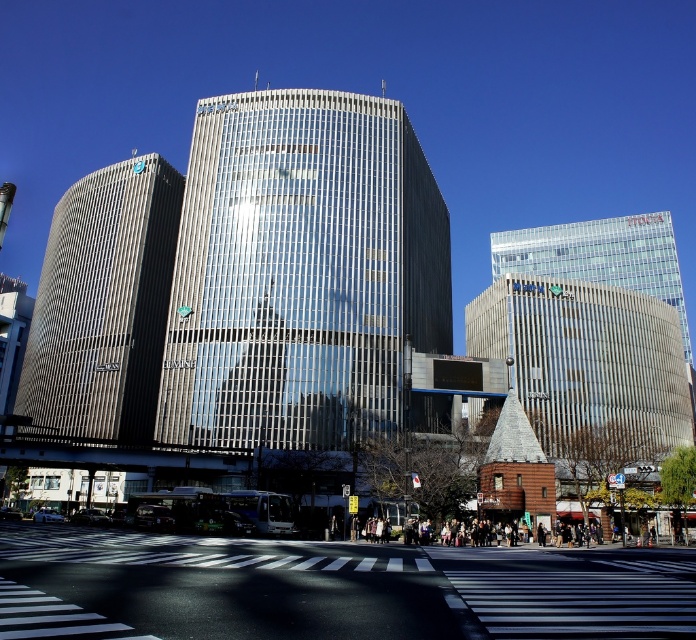
Question: Is glassy reflective building at center above metallic silver building at left?

Choices:
 (A) no
 (B) yes

Answer: (B)

Question: Can you confirm if metallic silver building at left is smaller than brown wooden tower at center?

Choices:
 (A) yes
 (B) no

Answer: (B)

Question: Among these objects, which one is farthest from the camera?

Choices:
 (A) glassy reflective building at center
 (B) metallic silver building at left
 (C) transparent glass building at upper right

Answer: (C)

Question: Which point is farther from the camera taking this photo?

Choices:
 (A) (316, 112)
 (B) (599, 452)

Answer: (B)

Question: Which object is closer to the camera taking this photo?

Choices:
 (A) metallic silver building at left
 (B) brown wooden tower at center

Answer: (A)

Question: Does metallic silver building at left have a smaller size compared to transparent glass building at upper right?

Choices:
 (A) no
 (B) yes

Answer: (B)